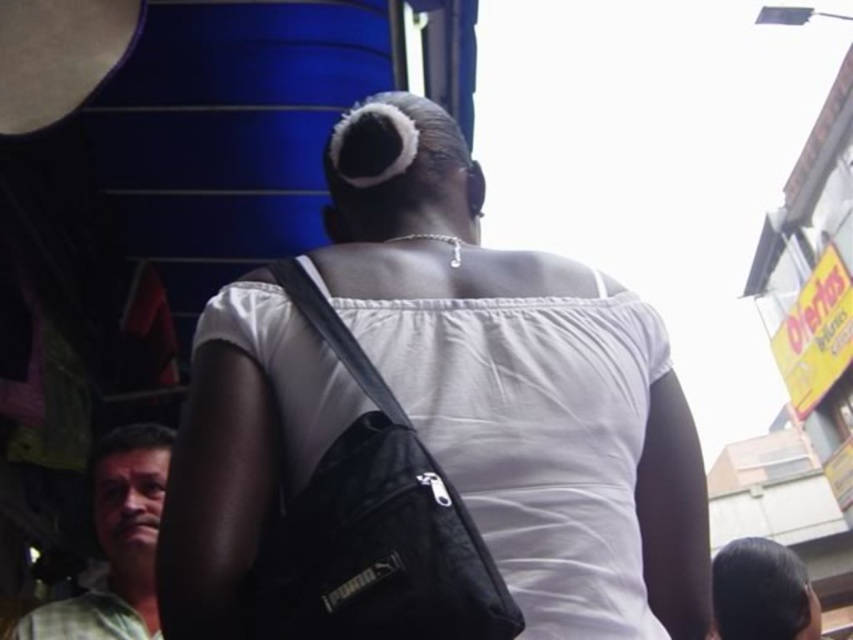
You are a fashion designer observing the scene. You need to determine which item takes up more visual space in the image between the black fabric shoulder bag at center and the green plaid shirt at lower left. Which one should you focus on for your design inspiration?

The green plaid shirt at lower left occupies more visual space than the black fabric shoulder bag at center, so you should focus on the green plaid shirt at lower left for your design inspiration.

You are a fashion designer observing the scene. You need to decide which item has a greater width between the white matte shoulder bag at center and the green plaid shirt at lower left. Which one is wider?

The white matte shoulder bag at center is wider than the green plaid shirt at lower left.